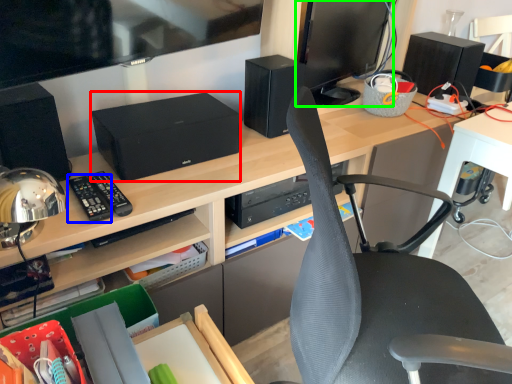
Question: Based on their relative distances, which object is nearer to printer (highlighted by a red box)? Choose from control (highlighted by a blue box) and computer monitor (highlighted by a green box).

Choices:
 (A) control
 (B) computer monitor

Answer: (A)